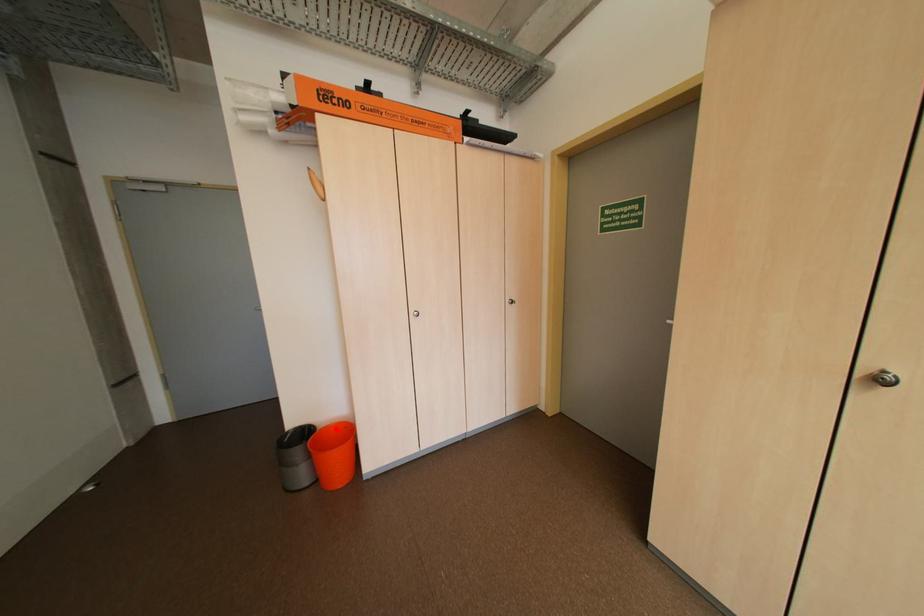
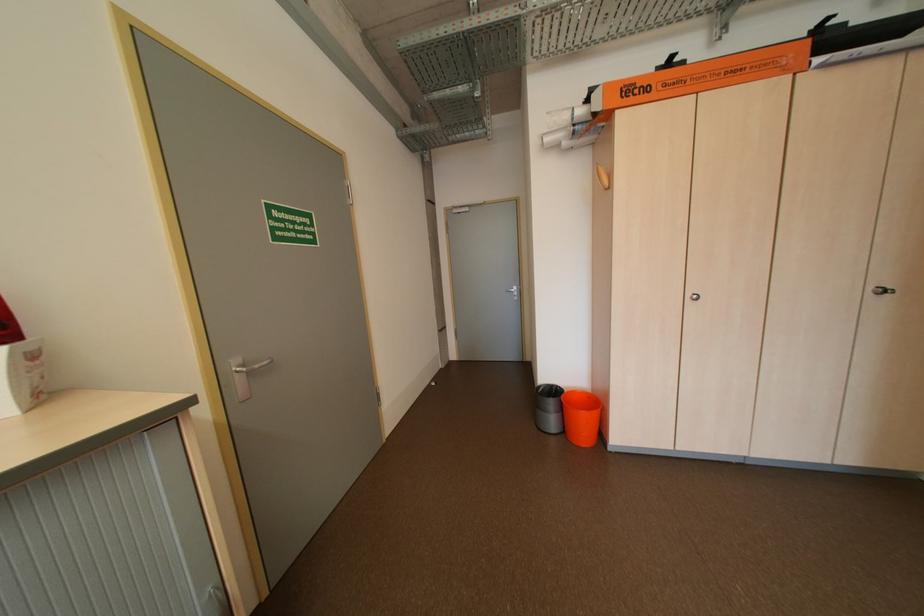
Find the pixel in the second image that matches the highlighted location in the first image.

(582, 392)